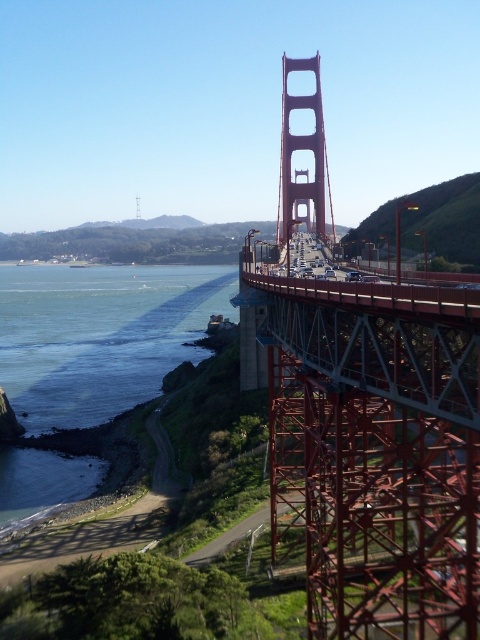
You are a photographer planning to capture the Golden Gate Bridge in a wide shot. You want to ensure that both the red painted steel suspension bridge at center and the blue water at lower left are clearly visible. Based on their widths, which object should you adjust your camera angle to prioritize if you need to focus on the narrower one?

The red painted steel suspension bridge at center is thinner than the blue water at lower left, so you should prioritize focusing on the red painted steel suspension bridge at center since it is narrower and might require a more precise angle to capture its details clearly.

You are a photographer planning to capture the Golden Gate Bridge from a specific viewpoint. You notice the red painted steel suspension bridge at center and the blue water at lower left in your frame. Which object appears taller in the photo?

The red painted steel suspension bridge at center appears taller than the blue water at lower left in the photo.

You are a photographer planning to capture the Golden Gate Bridge from a boat positioned near the blue water at lower left. You want to ensure the red painted steel suspension bridge at center is clearly visible in the background of your photo. Based on the scene description, will the bridge be visible behind the water?

The red painted steel suspension bridge at center is in front of blue water at lower left, so the bridge will be visible in the background behind the blue water at lower left when taking the photo from the boat.